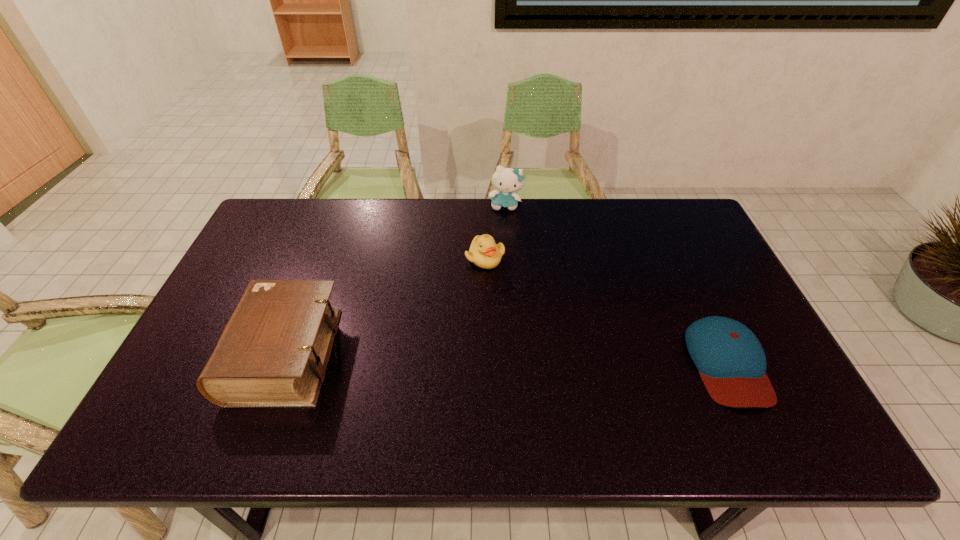
Where is `free location located on the spine side of the leftmost object`? The width and height of the screenshot is (960, 540). free location located on the spine side of the leftmost object is located at coordinates (209, 355).

At what (x,y) coordinates should I click in order to perform the action: click on vacant space located 0.180m on the beak of the second farthest object. Please return your answer as a coordinate pair (x, y). This screenshot has width=960, height=540. Looking at the image, I should click on (469, 316).

Identify the location of vacant space situated on the beak of the second farthest object. (454, 379).

At what (x,y) coordinates should I click in order to perform the action: click on vacant space located 0.120m on the beak of the second farthest object. Please return your answer as a coordinate pair (x, y). Image resolution: width=960 pixels, height=540 pixels. Looking at the image, I should click on (474, 300).

Where is `free space located 0.370m on the face of the farthest object`? The image size is (960, 540). free space located 0.370m on the face of the farthest object is located at coordinates (495, 290).

Locate an element on the screen. The height and width of the screenshot is (540, 960). vacant region located on the face of the farthest object is located at coordinates (495, 293).

The width and height of the screenshot is (960, 540). In order to click on vacant space situated on the face of the farthest object in this screenshot , I will do `click(496, 283)`.

The image size is (960, 540). Find the location of `object that is at the far edge`. object that is at the far edge is located at coordinates (506, 180).

Identify the location of Bible at the near edge. Image resolution: width=960 pixels, height=540 pixels. (273, 352).

You are a GUI agent. You are given a task and a screenshot of the screen. Output one action in this format:
    pyautogui.click(x=<x>, y=<y>)
    Task: Click on the baseball cap that is at the near edge
    The width and height of the screenshot is (960, 540).
    Given the screenshot: What is the action you would take?
    pyautogui.click(x=731, y=362)